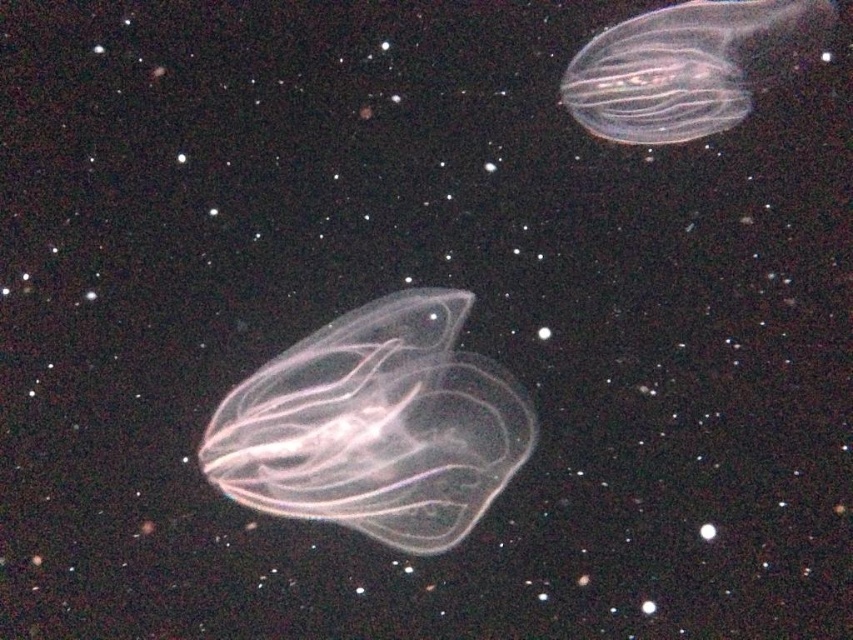
You are an underwater explorer observing two points in the dark environment. The first point is labeled as point [257,445] and the second is point [630,77]. Which point is nearer to you?

Point [257,445] is closer to the viewer than point [630,77].

You are standing in front of the jellyfish creatures. There is a point at coordinates point (387, 472). Can you reach this point without moving from your current position?

The point (387, 472) is 5.21 feet away from the viewer, so you cannot reach it without moving from your current position.

You are an underwater explorer observing the scene. You notice a transparent gelatinous creature at center. If you were to move directly towards the center of the image, would you collide with the transparent gelatinous at center?

Yes, moving directly towards the center of the image would lead you to collide with the transparent gelatinous at center since it is located exactly at the center coordinates provided.